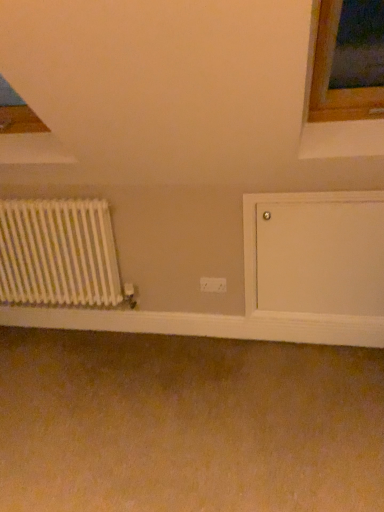
Question: From the image's perspective, is white smooth wood at lower center located beneath white plastic electric outlet at center?

Choices:
 (A) yes
 (B) no

Answer: (A)

Question: Is white smooth wood at lower center thinner than white plastic electric outlet at center?

Choices:
 (A) yes
 (B) no

Answer: (B)

Question: Is the position of white smooth wood at lower center less distant than that of white plastic electric outlet at center?

Choices:
 (A) no
 (B) yes

Answer: (B)

Question: Is white smooth wood at lower center bigger than white plastic electric outlet at center?

Choices:
 (A) no
 (B) yes

Answer: (B)

Question: Is white smooth wood at lower center not within white plastic electric outlet at center?

Choices:
 (A) no
 (B) yes

Answer: (B)

Question: Considering the relative positions of white smooth wood at lower center and white plastic electric outlet at center in the image provided, is white smooth wood at lower center to the left of white plastic electric outlet at center from the viewer's perspective?

Choices:
 (A) no
 (B) yes

Answer: (B)

Question: From the image's perspective, does white matte radiator at left appear lower than white smooth wood at lower center?

Choices:
 (A) no
 (B) yes

Answer: (A)

Question: Is white matte radiator at left turned away from white smooth wood at lower center?

Choices:
 (A) yes
 (B) no

Answer: (B)

Question: Is white matte radiator at left to the right of white smooth wood at lower center from the viewer's perspective?

Choices:
 (A) no
 (B) yes

Answer: (A)

Question: From a real-world perspective, is white matte radiator at left below white smooth wood at lower center?

Choices:
 (A) yes
 (B) no

Answer: (B)

Question: Is white matte radiator at left at the left side of white smooth wood at lower center?

Choices:
 (A) no
 (B) yes

Answer: (B)

Question: From a real-world perspective, is white matte radiator at left on top of white smooth wood at lower center?

Choices:
 (A) yes
 (B) no

Answer: (A)

Question: Can you confirm if white smooth wood at lower center is wider than white matte radiator at left?

Choices:
 (A) yes
 (B) no

Answer: (B)